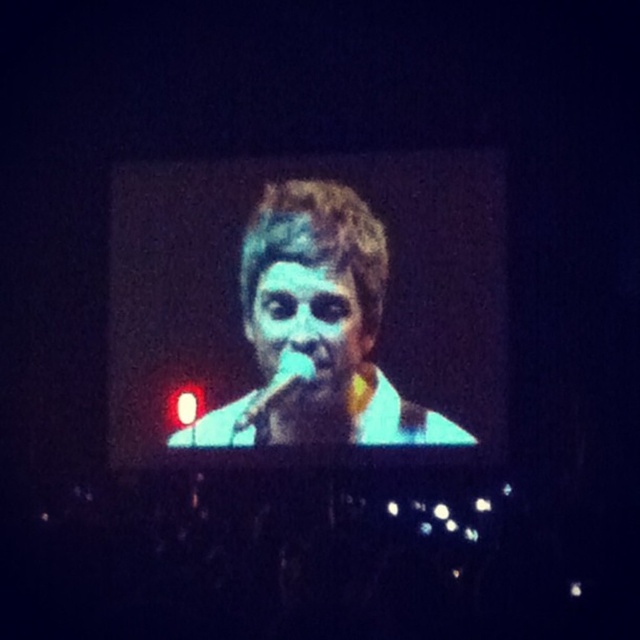
Question: Is blue-tinted skin at center below blue matte face at center?

Choices:
 (A) no
 (B) yes

Answer: (B)

Question: Which point is farther from the camera taking this photo?

Choices:
 (A) (326, 340)
 (B) (298, 333)

Answer: (A)

Question: Among these objects, which one is farthest from the camera?

Choices:
 (A) blue-tinted skin at center
 (B) blue matte face at center

Answer: (A)

Question: Does blue-tinted skin at center appear over blue matte face at center?

Choices:
 (A) yes
 (B) no

Answer: (B)

Question: Does blue-tinted skin at center lie behind blue matte face at center?

Choices:
 (A) yes
 (B) no

Answer: (A)